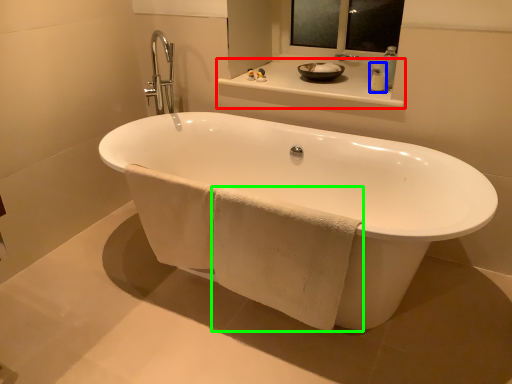
Question: Considering the real-world distances, which object is farthest from counter top (highlighted by a red box)? soap dispenser (highlighted by a blue box) or bath towel (highlighted by a green box)?

Choices:
 (A) soap dispenser
 (B) bath towel

Answer: (B)